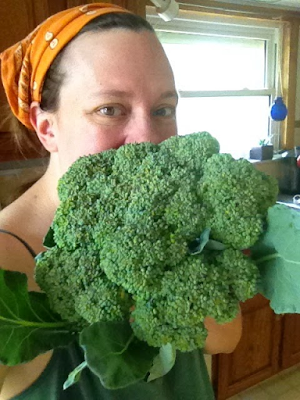
Locate an element on the screen. floor is located at coordinates (279, 390).